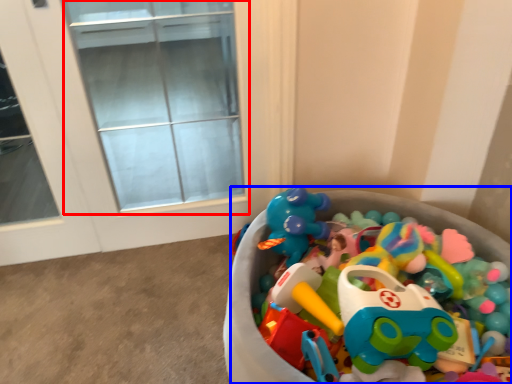
Question: Which point is closer to the camera, glass door (highlighted by a red box) or toy (highlighted by a blue box)?

Choices:
 (A) glass door
 (B) toy

Answer: (B)